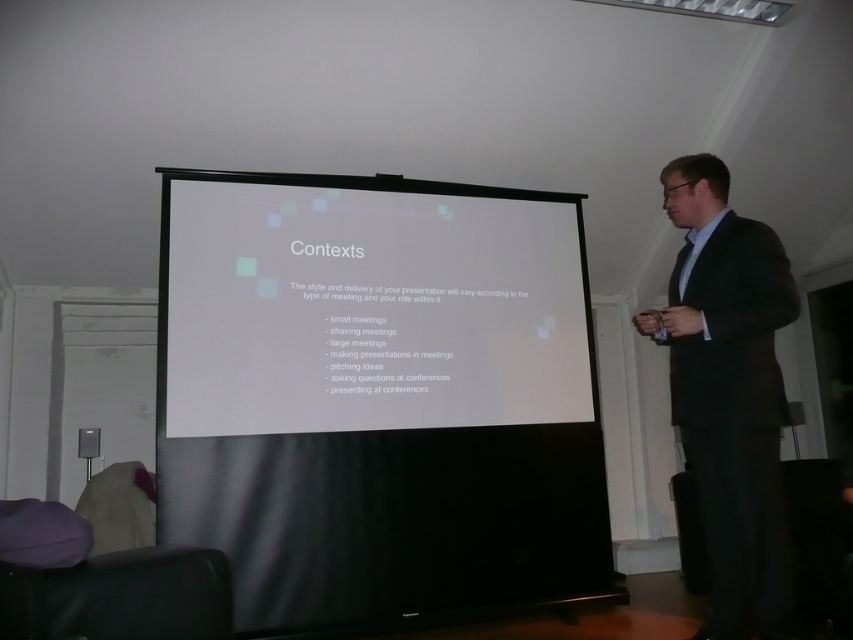
Who is taller, white matte projection screen at center or black suit at right?

black suit at right is taller.

Does white matte projection screen at center appear on the right side of black suit at right?

In fact, white matte projection screen at center is to the left of black suit at right.

Which is behind, point (212, 356) or point (730, 332)?

Point (212, 356)

This screenshot has height=640, width=853. I want to click on white matte projection screen at center, so click(370, 308).